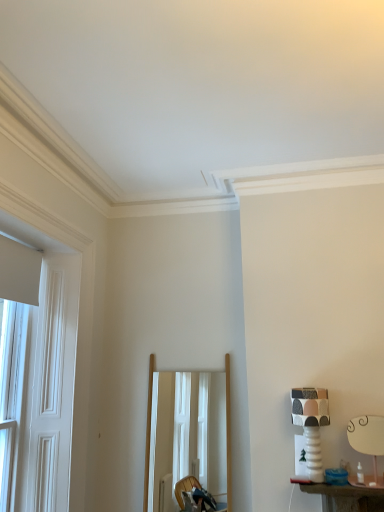
Question: Should I look upward or downward to see white wooden door at left?

Choices:
 (A) down
 (B) up

Answer: (A)

Question: Is patterned ceramic table lamp at right, which is the 2th table lamp in right-to-left order, surrounded by white wooden door at left?

Choices:
 (A) yes
 (B) no

Answer: (B)

Question: From a real-world perspective, is white wooden door at left located higher than patterned ceramic table lamp at right, which is the 2th table lamp in right-to-left order?

Choices:
 (A) yes
 (B) no

Answer: (A)

Question: Is white wooden door at left turned away from patterned ceramic table lamp at right, which is the 2th table lamp in right-to-left order?

Choices:
 (A) no
 (B) yes

Answer: (A)

Question: Is white wooden door at left far from patterned ceramic table lamp at right, which is the 2th table lamp in right-to-left order?

Choices:
 (A) yes
 (B) no

Answer: (A)

Question: Does white wooden door at left appear on the left side of patterned ceramic table lamp at right, which ranks as the 1th table lamp in left-to-right order?

Choices:
 (A) no
 (B) yes

Answer: (B)

Question: From the image's perspective, does white wooden door at left appear lower than patterned ceramic table lamp at right, which ranks as the 1th table lamp in left-to-right order?

Choices:
 (A) no
 (B) yes

Answer: (A)

Question: Does white wooden door at left have a lesser height compared to white ceramic table lamp at right, which is counted as the first table lamp, starting from the right?

Choices:
 (A) yes
 (B) no

Answer: (B)

Question: Is white wooden door at left at the left side of white ceramic table lamp at right, the second table lamp viewed from the left?

Choices:
 (A) no
 (B) yes

Answer: (B)

Question: Is white wooden door at left facing away from white ceramic table lamp at right, the second table lamp viewed from the left?

Choices:
 (A) yes
 (B) no

Answer: (B)

Question: Is white wooden door at left in front of white ceramic table lamp at right, which is counted as the first table lamp, starting from the right?

Choices:
 (A) yes
 (B) no

Answer: (A)

Question: Is white wooden door at left not close to white ceramic table lamp at right, which is counted as the first table lamp, starting from the right?

Choices:
 (A) no
 (B) yes

Answer: (B)

Question: Is white ceramic table lamp at right, which is counted as the first table lamp, starting from the right, surrounded by white wooden door at left?

Choices:
 (A) yes
 (B) no

Answer: (B)

Question: Is patterned ceramic table lamp at right, which ranks as the 1th table lamp in left-to-right order, not near white wooden door at left?

Choices:
 (A) no
 (B) yes

Answer: (B)